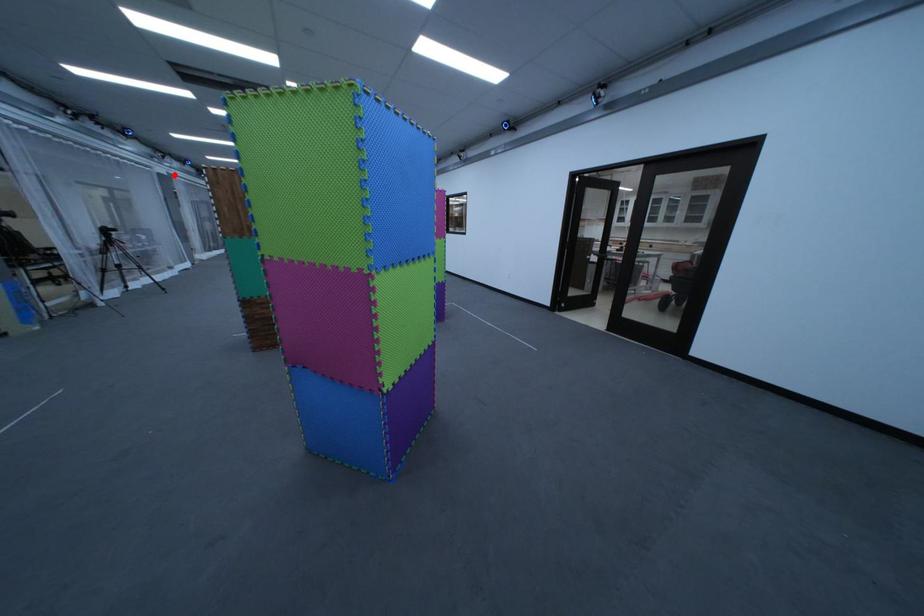
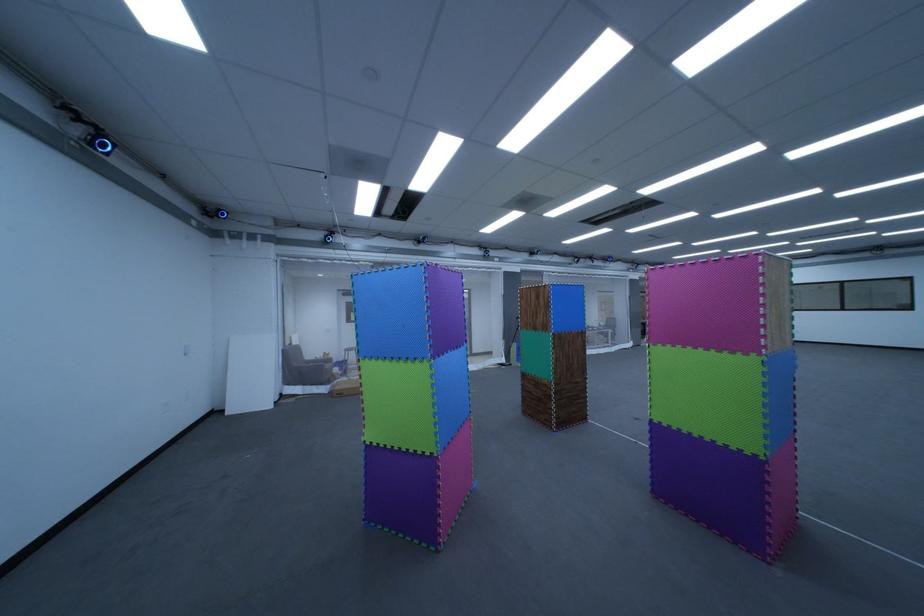
In the second image, find the point that corresponds to the highlighted location in the first image.

(647, 281)